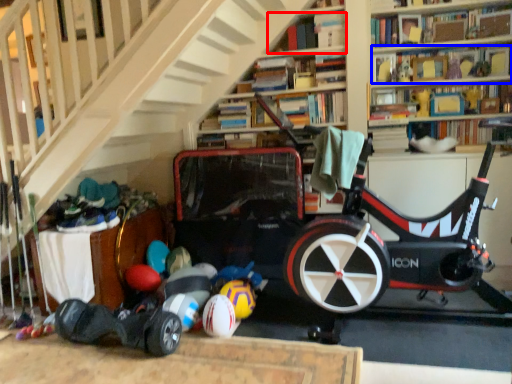
Question: Which object is closer to the camera taking this photo, book (highlighted by a red box) or book (highlighted by a blue box)?

Choices:
 (A) book
 (B) book

Answer: (A)